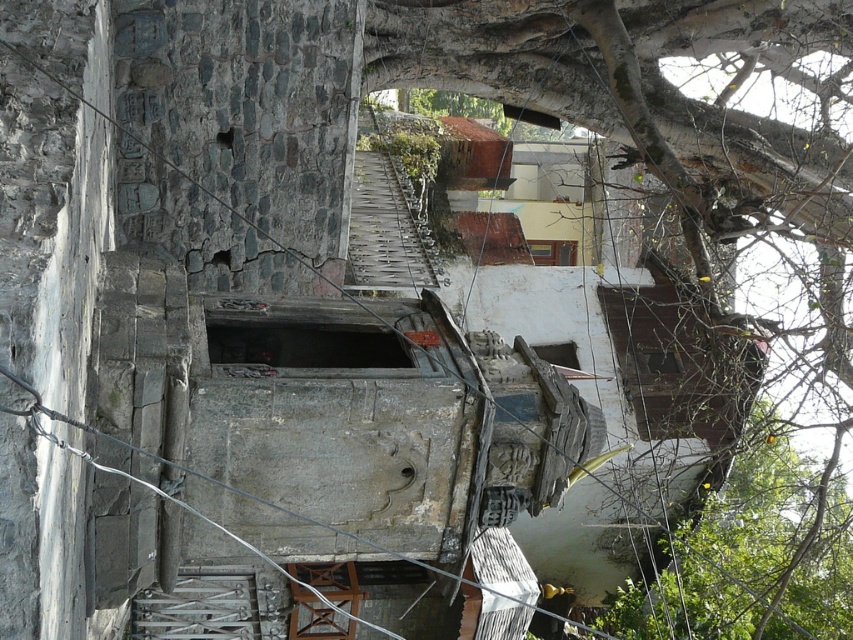
You are standing at the entrance of the stone structure and see the metallic wrought iron stairs at lower center and the wooden stool at center. Which object is closer to the ground?

The metallic wrought iron stairs at lower center are closer to the ground since they are positioned below the wooden stool at center.

You are standing at the entrance of the stone structure and see the point labeled as point (199,605). Where is this point located?

The point labeled (199,605) is located on the metallic wrought iron stairs at lower center.